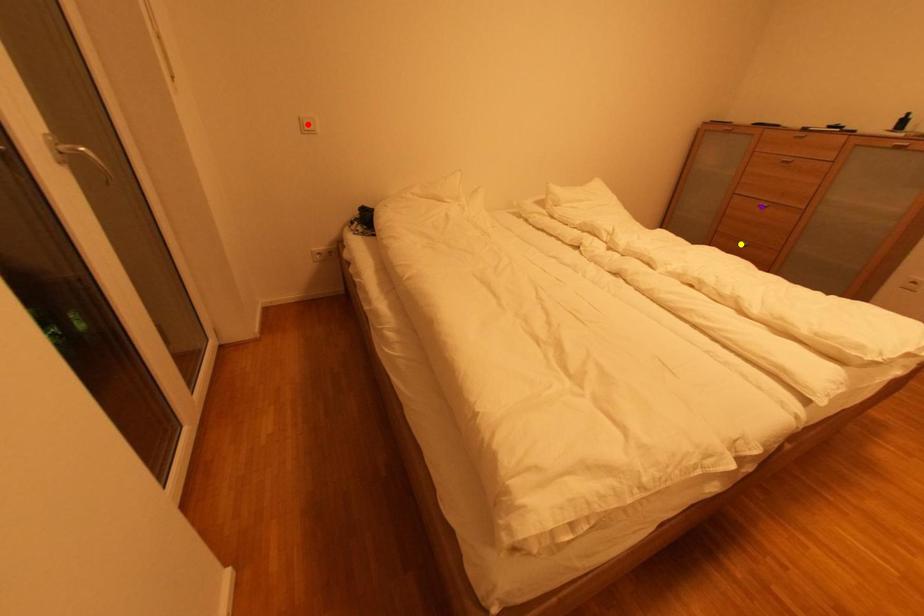
Order these from nearest to farthest:
purple point, yellow point, red point

1. red point
2. purple point
3. yellow point